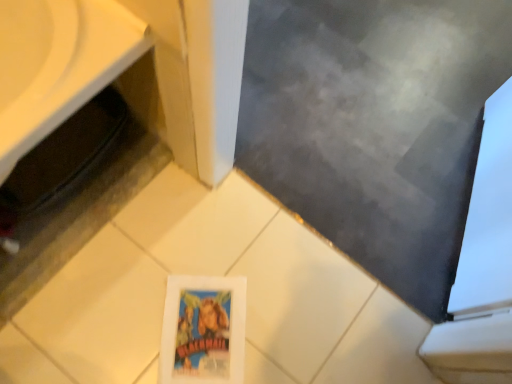
Measure the distance between point [275,92] and camera.

Point [275,92] and camera are 1.35 meters apart from each other.

This screenshot has height=384, width=512. In order to click on matte gray board at center in this screenshot , I will do `click(375, 126)`.

This screenshot has height=384, width=512. What do you see at coordinates (375, 126) in the screenshot?
I see `matte gray board at center` at bounding box center [375, 126].

Identify the location of matte gray board at center. The image size is (512, 384). (375, 126).